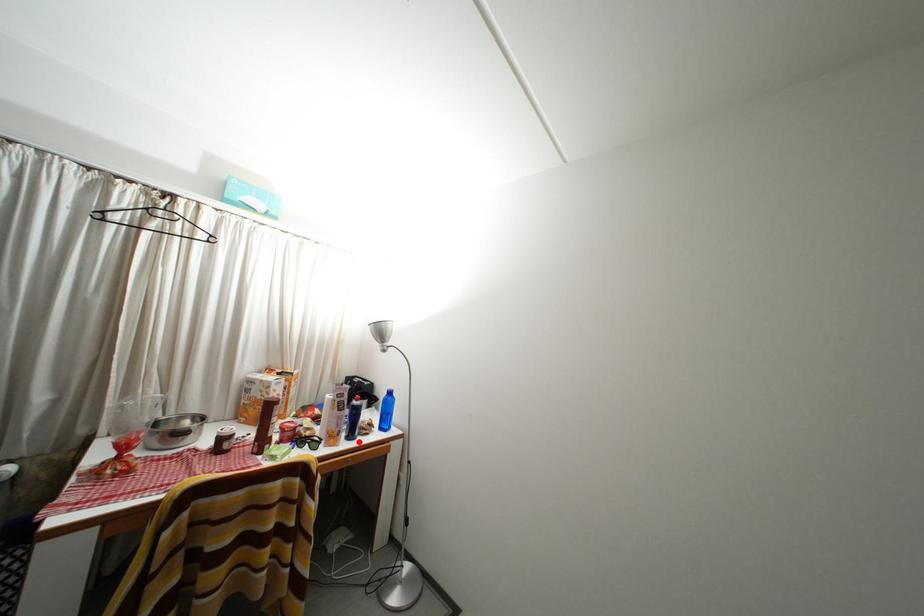
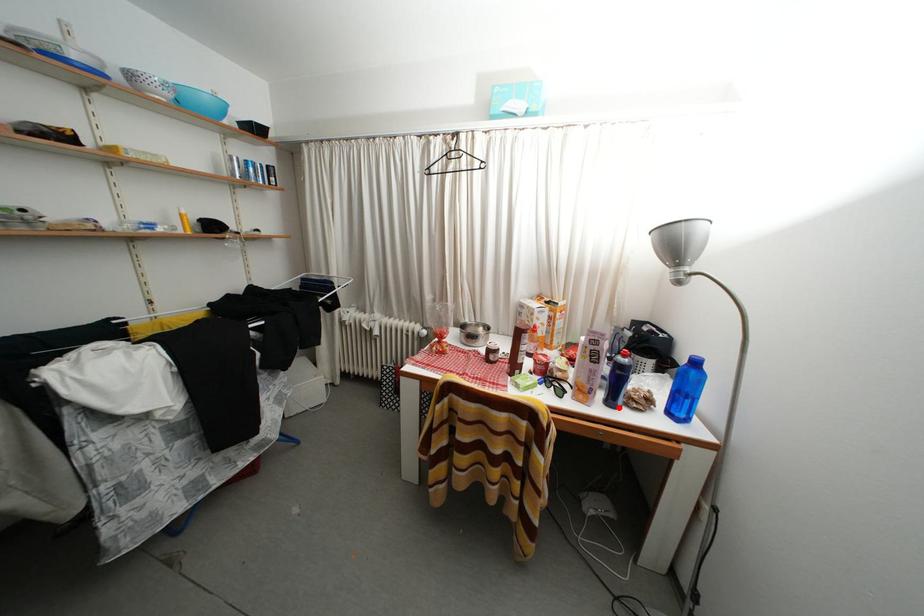
From the picture: I am providing you with two images of the same scene from different viewpoints. A red point is marked on the first image and another point is marked on the second image. Are the points marked in image1 and image2 representing the same 3D position?

Yes